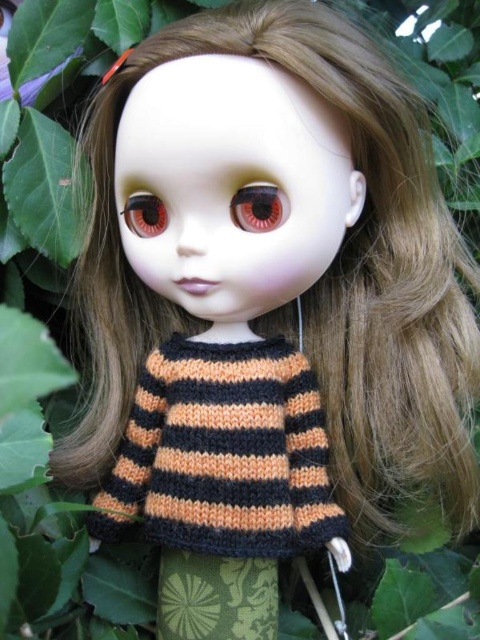
Between orange knitted sweater at center and green knitted leggings at lower center, which one appears on the left side from the viewer's perspective?

green knitted leggings at lower center

Does orange knitted sweater at center appear under green knitted leggings at lower center?

No, orange knitted sweater at center is not below green knitted leggings at lower center.

Locate an element on the screen. This screenshot has width=480, height=640. orange knitted sweater at center is located at coordinates (224, 452).

Is green knitted leggings at lower center closer to camera compared to matte brown eye at center?

No, green knitted leggings at lower center is further to the viewer.

Is point (276, 566) positioned behind point (260, 182)?

Yes, it is behind point (260, 182).

This screenshot has height=640, width=480. I want to click on green knitted leggings at lower center, so click(x=216, y=596).

Is point (286, 529) positioned in front of point (142, 202)?

Yes, it is in front of point (142, 202).

Does orange knitted sweater at center have a lesser height compared to matte plastic eye at center?

In fact, orange knitted sweater at center may be taller than matte plastic eye at center.

Who is more forward, (264, 556) or (129, 228)?

Point (264, 556)

In order to click on orange knitted sweater at center in this screenshot , I will do `click(224, 452)`.